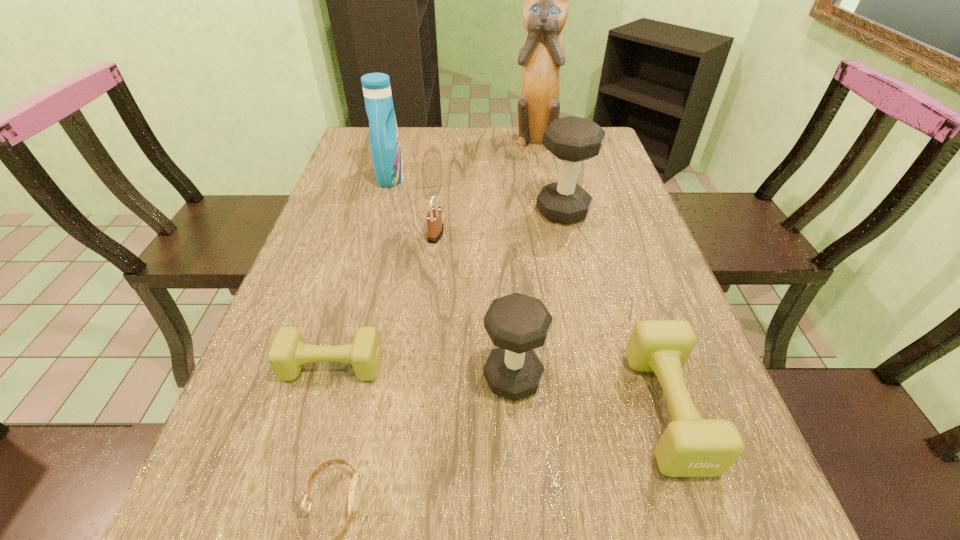
Identify the location of the tallest object. The height and width of the screenshot is (540, 960). (545, 8).

Image resolution: width=960 pixels, height=540 pixels. I want to click on the farthest object, so click(x=545, y=8).

The image size is (960, 540). What are the coordinates of `the seventh nearest object` in the screenshot? It's located at (x=384, y=139).

The width and height of the screenshot is (960, 540). I want to click on detergent, so click(384, 139).

Where is `the tallest dumbbell`? This screenshot has height=540, width=960. the tallest dumbbell is located at coordinates (571, 139).

You are a GUI agent. You are given a task and a screenshot of the screen. Output one action in this format:
    pyautogui.click(x=<x>, y=<y>)
    Task: Click on the farthest dumbbell
    
    Given the screenshot: What is the action you would take?
    pyautogui.click(x=571, y=139)

At what (x,y) coordinates should I click in order to perform the action: click on the left gray dumbbell. Please return your answer as a coordinate pair (x, y). Looking at the image, I should click on (516, 323).

Identify the location of the second tallest dumbbell. This screenshot has width=960, height=540. (516, 323).

This screenshot has height=540, width=960. What are the coordinates of `padlock` in the screenshot? It's located at (435, 227).

The width and height of the screenshot is (960, 540). What are the coordinates of `the third tallest dumbbell` in the screenshot? It's located at (690, 446).